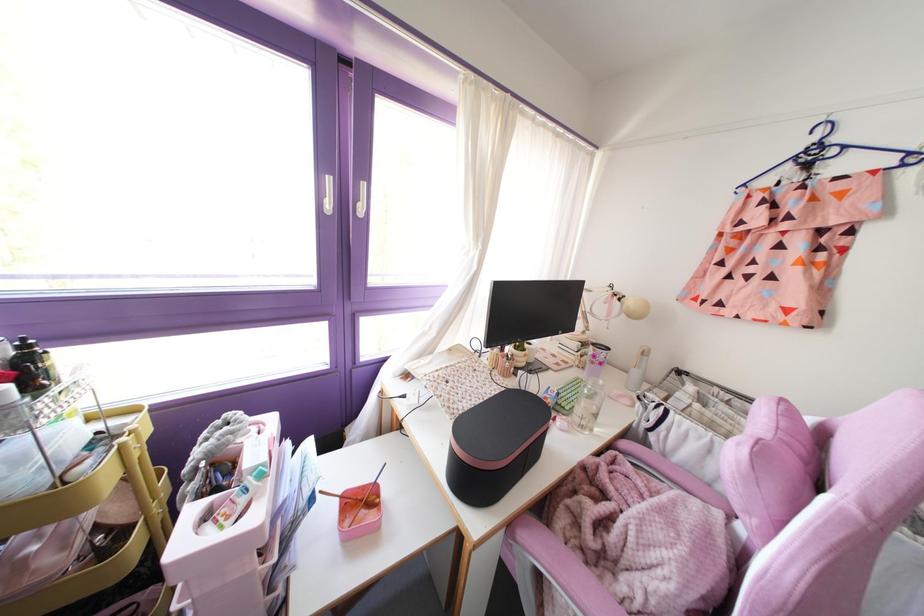
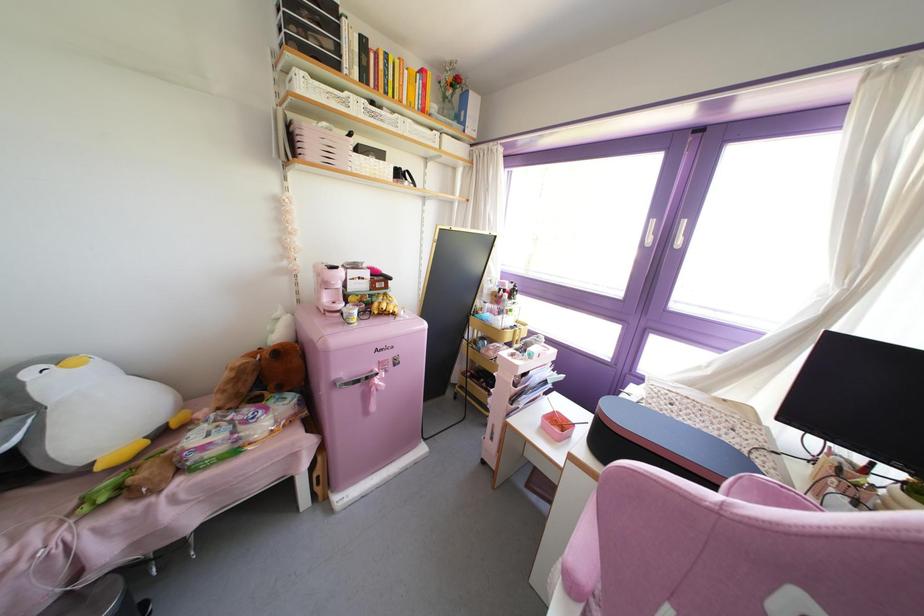
Locate, in the second image, the point that corresponds to (329,179) in the first image.

(652, 222)